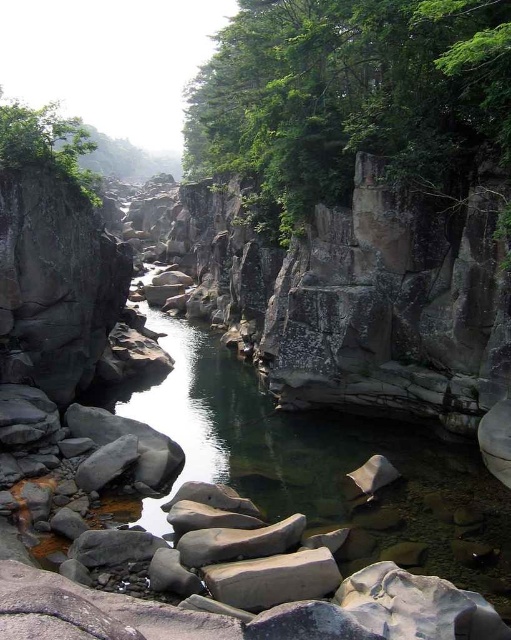
You are a hiker planning to cross the river in the canyon. You notice two green leafy trees in the upper part of the scene. Which tree has a smaller width, the green leafy tree at upper center or the green leafy tree at upper left?

The green leafy tree at upper center has a smaller width than the green leafy tree at upper left.

You are standing at the edge of the canyon looking towards the river. You notice two green leafy trees in the upper part of the scene. Which tree is closer to you, the green leafy tree at upper center or the green leafy tree at upper left?

The green leafy tree at upper center is closer to the viewer than the green leafy tree at upper left.

From the picture: You are hiking through the canyon and want to take a photo of both the green leafy tree at upper center and the green leafy tree at upper left. Which tree should you stand closer to in order to capture both in a single frame?

To capture both the green leafy tree at upper center and the green leafy tree at upper left in a single frame, you should stand closer to the green leafy tree at upper left. Since the green leafy tree at upper center is positioned under the green leafy tree at upper left, adjusting your position closer to the upper left tree will allow both trees to be included in your photo.